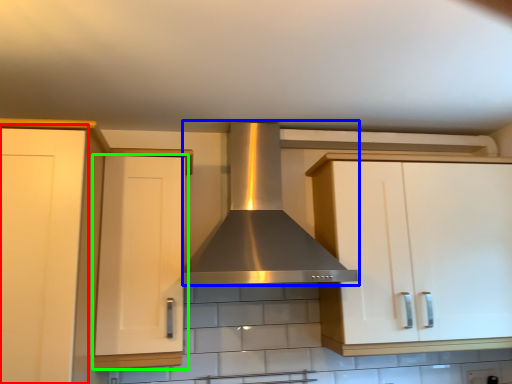
Question: Which object is the closest to the cabinetry (highlighted by a red box)? Choose among these: home appliance (highlighted by a blue box) or cabinetry (highlighted by a green box).

Choices:
 (A) home appliance
 (B) cabinetry

Answer: (B)